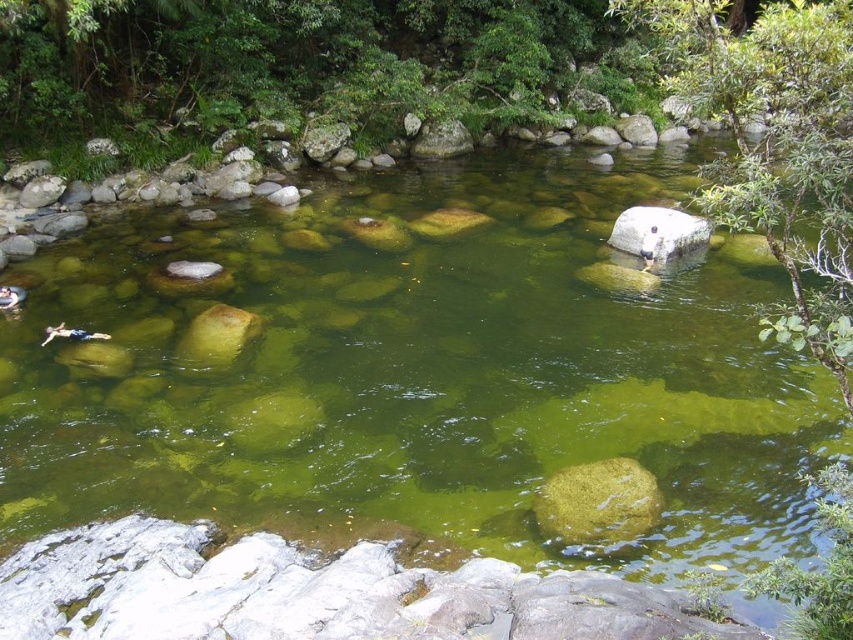
You are standing at the edge of the stream and want to pick up the green mossy rock at center and the white smooth rock at center. Which rock should you reach for first if you want to pick up the one that is closer to you?

The green mossy rock at center is closer to the viewer than the white smooth rock at center, so you should reach for the green mossy rock at center first.

You are standing at the edge of the stream and want to reach both points in the water. Which point, point (675,236) or point (451,125), is closer to you?

Point (675,236) is closer to the camera than point (451,125), so it is closer to you.